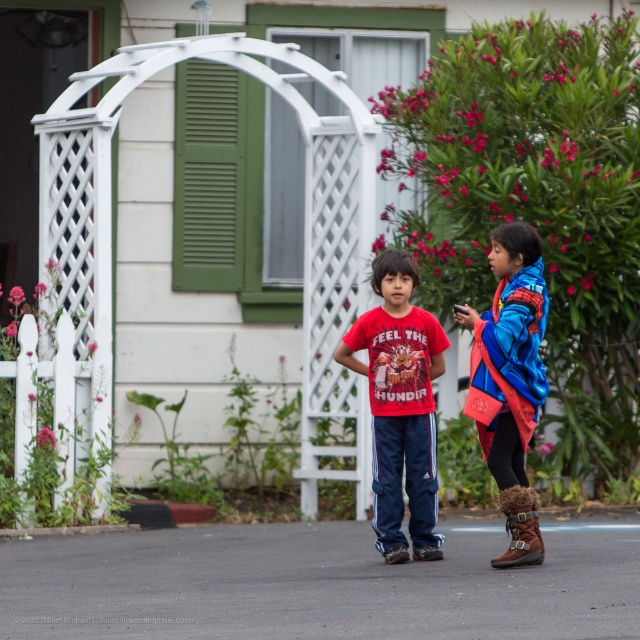
Is blue fleece jacket at center shorter than green painted wood at center?

No.

Is blue fleece jacket at center taller than green painted wood at center?

Yes.

The height and width of the screenshot is (640, 640). I want to click on blue fleece jacket at center, so click(x=509, y=380).

Where is `blue fleece jacket at center`? blue fleece jacket at center is located at coordinates (509, 380).

Between point (416, 358) and point (189, 112), which one is positioned behind?

Positioned behind is point (189, 112).

Can you confirm if matte red t-shirt at center is positioned below green painted wood at center?

Indeed, matte red t-shirt at center is positioned under green painted wood at center.

Locate an element on the screen. matte red t-shirt at center is located at coordinates (400, 404).

Can you confirm if matte red t-shirt at center is wider than blue fleece jacket at center?

Correct, the width of matte red t-shirt at center exceeds that of blue fleece jacket at center.

Does matte red t-shirt at center have a lesser width compared to blue fleece jacket at center?

In fact, matte red t-shirt at center might be wider than blue fleece jacket at center.

Locate an element on the screen. The height and width of the screenshot is (640, 640). matte red t-shirt at center is located at coordinates (400, 404).